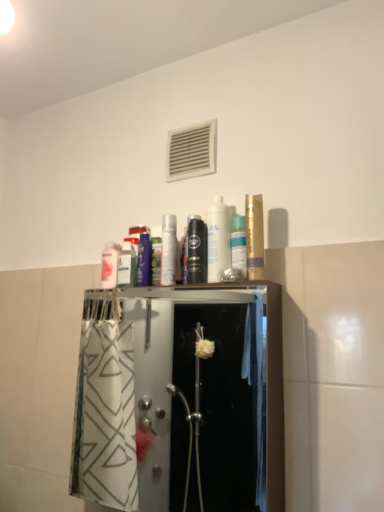
Question: From a real-world perspective, is matte white canister at center, the second toiletry viewed from the right, below gold metallic can at upper right, which ranks as the 3th mouthwash in left-to-right order?

Choices:
 (A) yes
 (B) no

Answer: (A)

Question: From the image's perspective, would you say matte white canister at center, arranged as the 3th toiletry when viewed from the left, is positioned over gold metallic can at upper right, which ranks as the 3th mouthwash in left-to-right order?

Choices:
 (A) no
 (B) yes

Answer: (A)

Question: Considering the relative sizes of matte white canister at center, arranged as the 3th toiletry when viewed from the left, and gold metallic can at upper right, which ranks as the first mouthwash in right-to-left order, in the image provided, is matte white canister at center, arranged as the 3th toiletry when viewed from the left, taller than gold metallic can at upper right, which ranks as the first mouthwash in right-to-left order,?

Choices:
 (A) no
 (B) yes

Answer: (B)

Question: Considering the relative sizes of matte white canister at center, the second toiletry viewed from the right, and gold metallic can at upper right, which ranks as the 3th mouthwash in left-to-right order, in the image provided, is matte white canister at center, the second toiletry viewed from the right, thinner than gold metallic can at upper right, which ranks as the 3th mouthwash in left-to-right order,?

Choices:
 (A) yes
 (B) no

Answer: (B)

Question: Is matte white canister at center, arranged as the 3th toiletry when viewed from the left, not near gold metallic can at upper right, which ranks as the first mouthwash in right-to-left order?

Choices:
 (A) no
 (B) yes

Answer: (A)

Question: Would you say silver metallic can at center, placed as the second toiletry when sorted from left to right, is to the left or to the right of transparent plastic shower door at center in the picture?

Choices:
 (A) right
 (B) left

Answer: (A)

Question: From a real-world perspective, is silver metallic can at center, placed as the second toiletry when sorted from left to right, positioned above or below transparent plastic shower door at center?

Choices:
 (A) below
 (B) above

Answer: (B)

Question: Considering the positions of point (173, 238) and point (170, 337), is point (173, 238) closer or farther from the camera than point (170, 337)?

Choices:
 (A) closer
 (B) farther

Answer: (A)

Question: Is silver metallic can at center, which is the third toiletry from right to left, bigger or smaller than transparent plastic shower door at center?

Choices:
 (A) small
 (B) big

Answer: (A)

Question: Is transparent plastic shower door at center wider or thinner than purple glossy mouthwash at center, marked as the first mouthwash in a left-to-right arrangement?

Choices:
 (A) wide
 (B) thin

Answer: (A)

Question: Based on their positions, is transparent plastic shower door at center located to the left or right of purple glossy mouthwash at center, the third mouthwash when ordered from right to left?

Choices:
 (A) right
 (B) left

Answer: (A)

Question: From a real-world perspective, relative to purple glossy mouthwash at center, marked as the first mouthwash in a left-to-right arrangement, is transparent plastic shower door at center vertically above or below?

Choices:
 (A) below
 (B) above

Answer: (A)

Question: Considering the positions of point (114, 305) and point (135, 228), is point (114, 305) closer or farther from the camera than point (135, 228)?

Choices:
 (A) closer
 (B) farther

Answer: (B)

Question: Would you say white plastic vent at upper center is to the left or to the right of silver metallic can at center, placed as the second toiletry when sorted from left to right, in the picture?

Choices:
 (A) right
 (B) left

Answer: (A)

Question: Is white plastic vent at upper center inside the boundaries of silver metallic can at center, which is the third toiletry from right to left, or outside?

Choices:
 (A) outside
 (B) inside

Answer: (A)